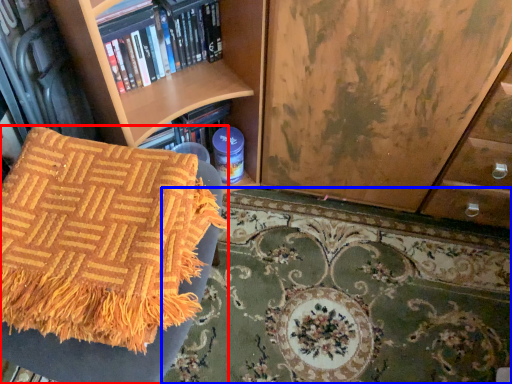
Question: Which of the following is the closest to the observer, furniture (highlighted by a red box) or mat (highlighted by a blue box)?

Choices:
 (A) furniture
 (B) mat

Answer: (A)